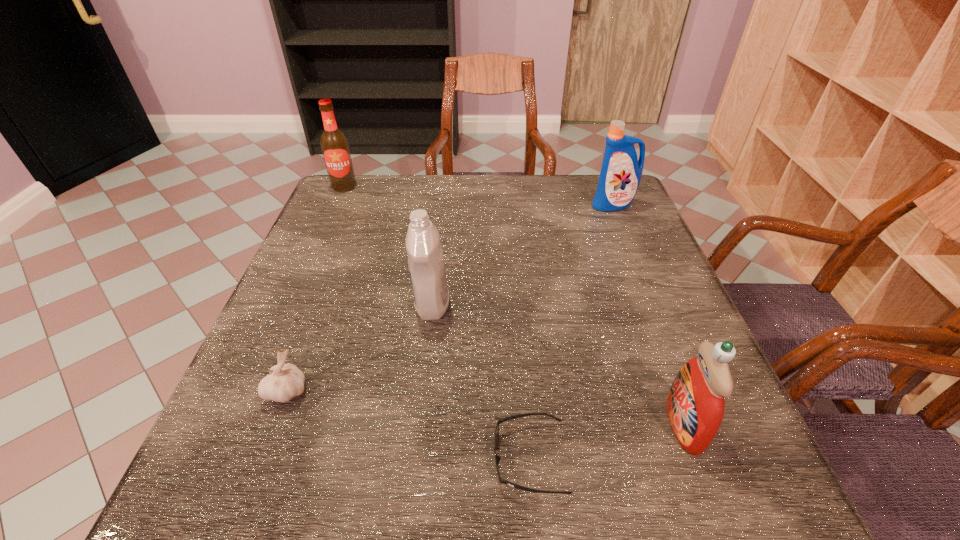
Identify the location of vacant area situated 0.190m on the back of the third farthest object. The height and width of the screenshot is (540, 960). coord(440,235).

Identify the location of free space located 0.090m on the front surface of the nearest detergent. This screenshot has width=960, height=540. (614, 424).

The height and width of the screenshot is (540, 960). What are the coordinates of `free point located on the front surface of the nearest detergent` in the screenshot? It's located at (596, 424).

You are a GUI agent. You are given a task and a screenshot of the screen. Output one action in this format:
    pyautogui.click(x=<x>, y=<y>)
    Task: Click on the vacant area situated 0.380m on the front surface of the nearest detergent
    The image size is (960, 540).
    Given the screenshot: What is the action you would take?
    pyautogui.click(x=443, y=424)

Image resolution: width=960 pixels, height=540 pixels. Identify the location of free region located on the right of the garlic. (352, 391).

Where is `vacant space situated on the front-facing side of the third object from right to left`? The height and width of the screenshot is (540, 960). vacant space situated on the front-facing side of the third object from right to left is located at coordinates pos(254,458).

At what (x,y) coordinates should I click in order to perform the action: click on vacant space located 0.130m on the front-facing side of the third object from right to left. Please return your answer as a coordinate pair (x, y). The height and width of the screenshot is (540, 960). Looking at the image, I should click on (412, 458).

The height and width of the screenshot is (540, 960). Identify the location of free space located 0.380m on the front-facing side of the third object from right to left. (254, 458).

I want to click on beer bottle situated at the far edge, so click(335, 148).

Where is `detergent that is at the far edge`? detergent that is at the far edge is located at coordinates (621, 172).